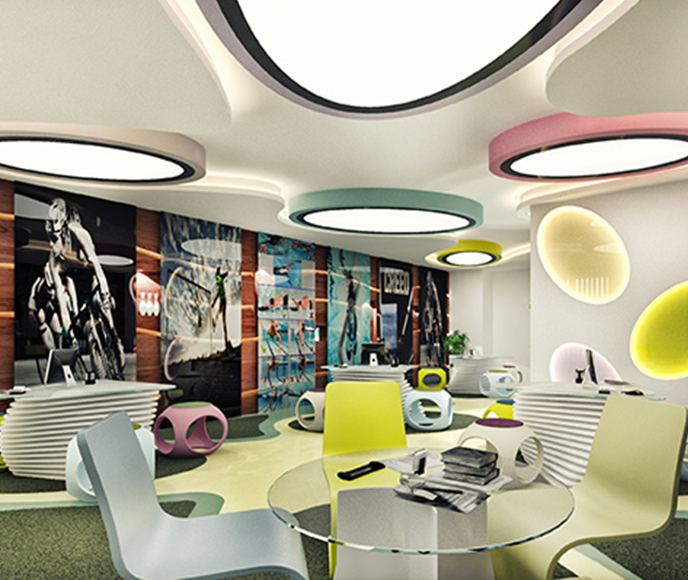
You are a GUI agent. You are given a task and a screenshot of the screen. Output one action in this format:
    pyautogui.click(x=<x>, y=<y>)
    Task: Click on the white wall
    This screenshot has width=688, height=580.
    Given the screenshot: What is the action you would take?
    pyautogui.click(x=510, y=316), pyautogui.click(x=603, y=321)